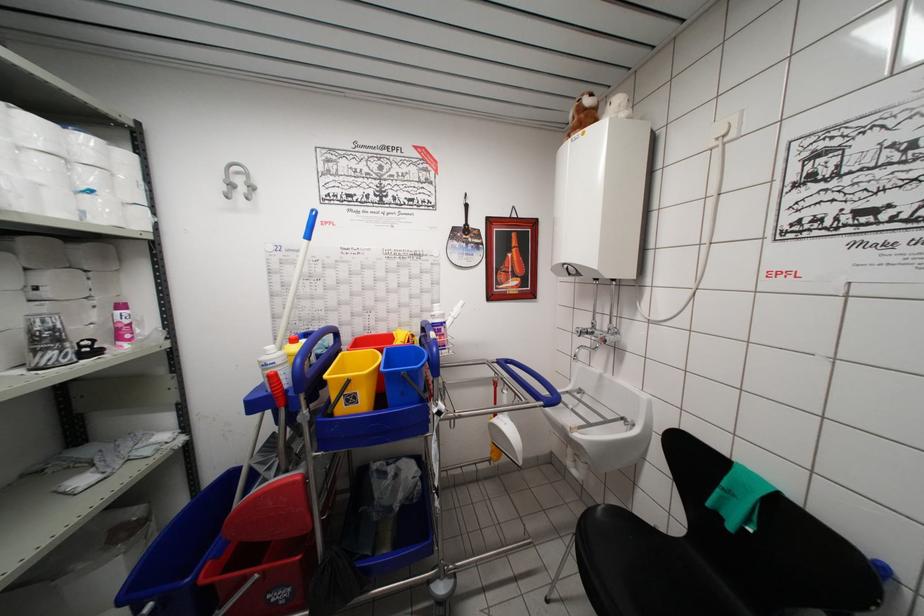
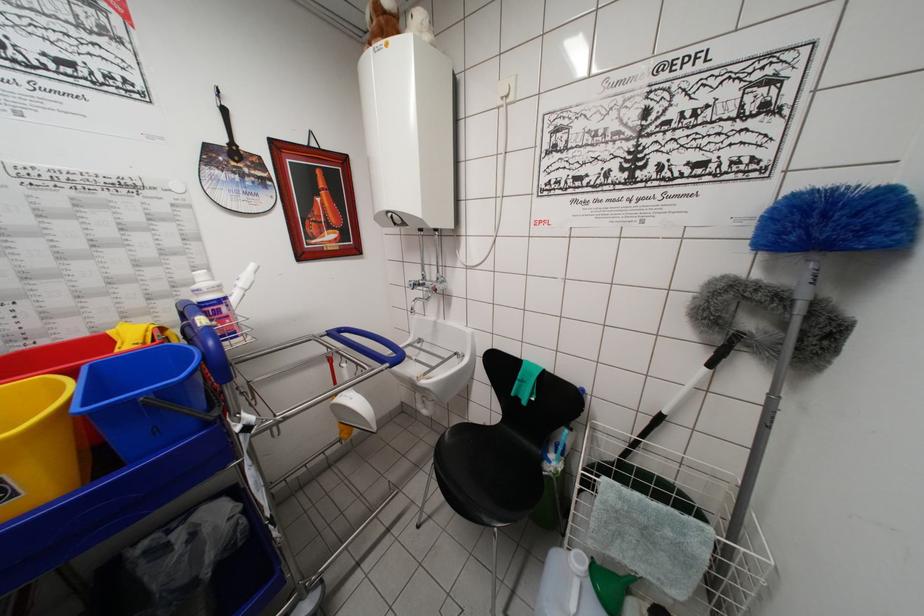
The point at (x=441, y=333) is marked in the first image. Where is the corresponding point in the second image?

(215, 315)